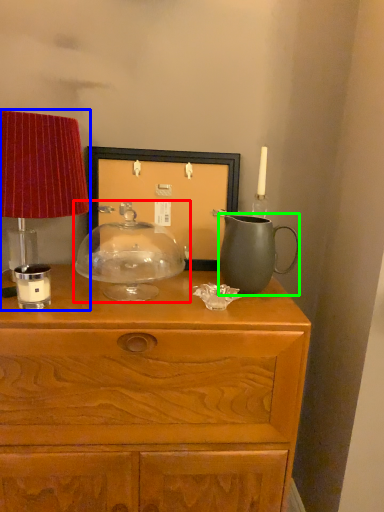
Question: Which is farther away from candle holder (highlighted by a red box)? table lamp (highlighted by a blue box) or jug (highlighted by a green box)?

Choices:
 (A) table lamp
 (B) jug

Answer: (B)